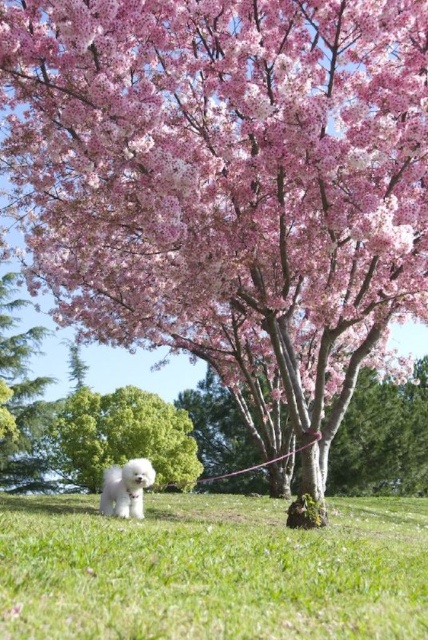
You are a photographer trying to capture a photo of the white fluffy dog at lower left and the green leafy tree at center. Since you want to include both in the frame, which object should you focus on first to ensure both are in focus?

The green leafy tree at center is taller than the white fluffy dog at lower left, so you should focus on the tree first as it is farther away and larger in the frame to ensure both are in focus.